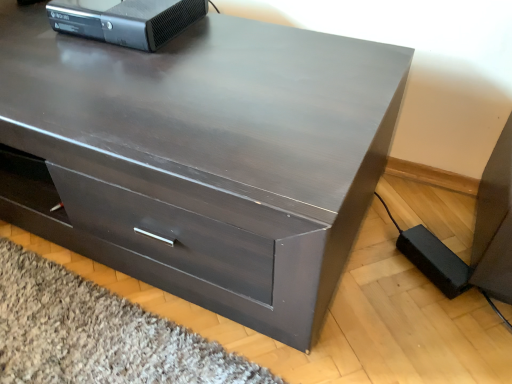
Where is `vacant area that is situated to the right of black plastic xbox 360 at upper left`? The width and height of the screenshot is (512, 384). vacant area that is situated to the right of black plastic xbox 360 at upper left is located at coordinates (232, 38).